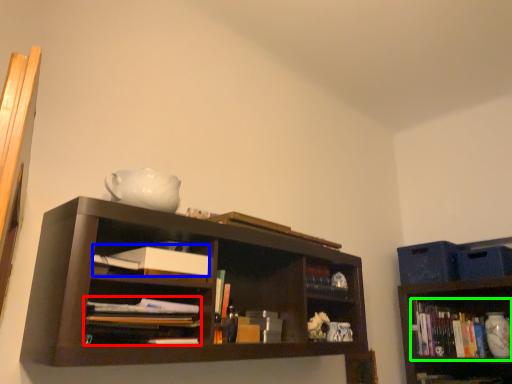
Question: Estimate the real-world distances between objects in this image. Which object is closer to book (highlighted by a red box), paperback book (highlighted by a blue box) or book (highlighted by a green box)?

Choices:
 (A) paperback book
 (B) book

Answer: (A)